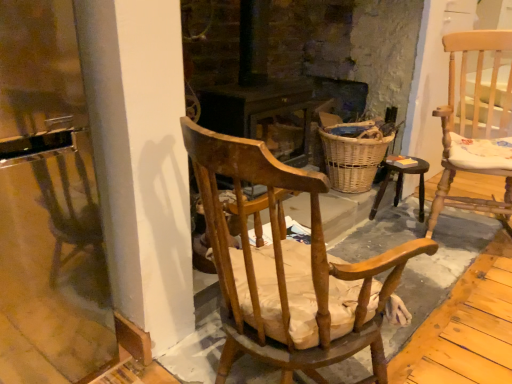
Where is `free spot in front of wooden stool at center`? This screenshot has width=512, height=384. free spot in front of wooden stool at center is located at coordinates (402, 235).